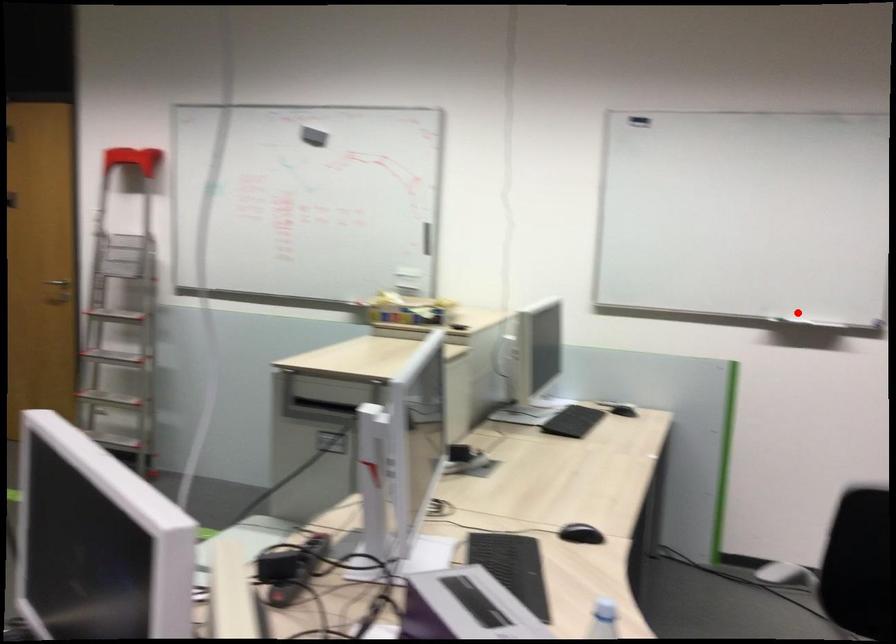
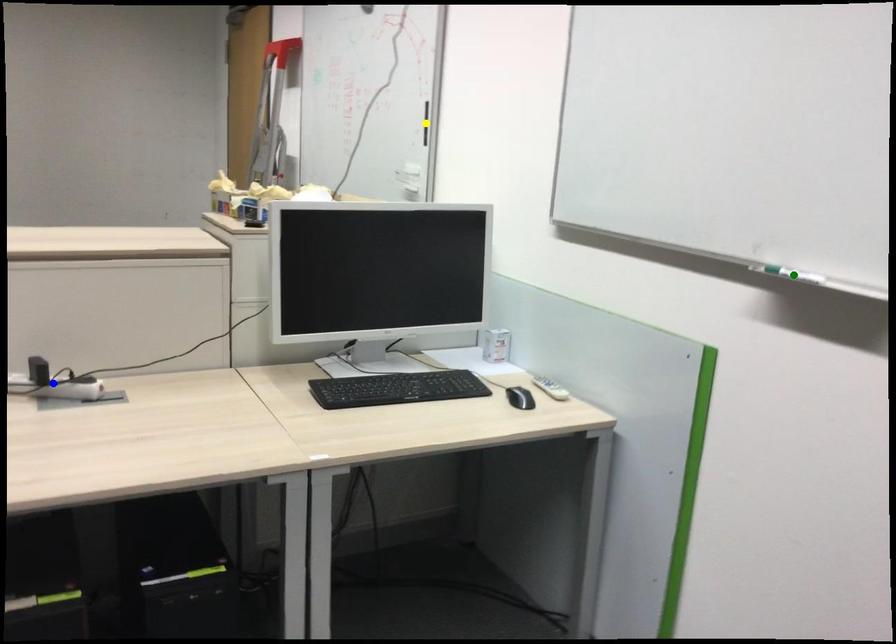
Question: I am providing you with two images of the same scene from different viewpoints. A red point is marked on the first image. You are given multiple points on the second image. Which point in image 2 is actually the same real-world point as the red point in image 1?

Choices:
 (A) blue point
 (B) yellow point
 (C) green point

Answer: (C)